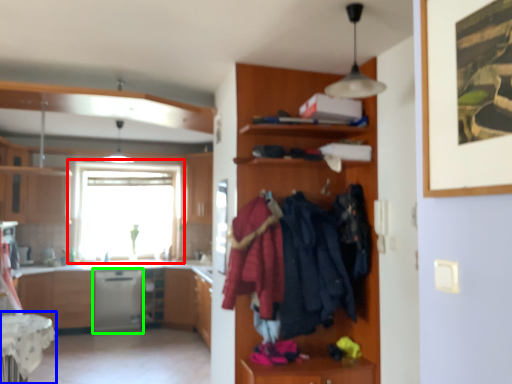
Question: Which is farther away from window (highlighted by a red box)? table (highlighted by a blue box) or dish washer (highlighted by a green box)?

Choices:
 (A) table
 (B) dish washer

Answer: (A)